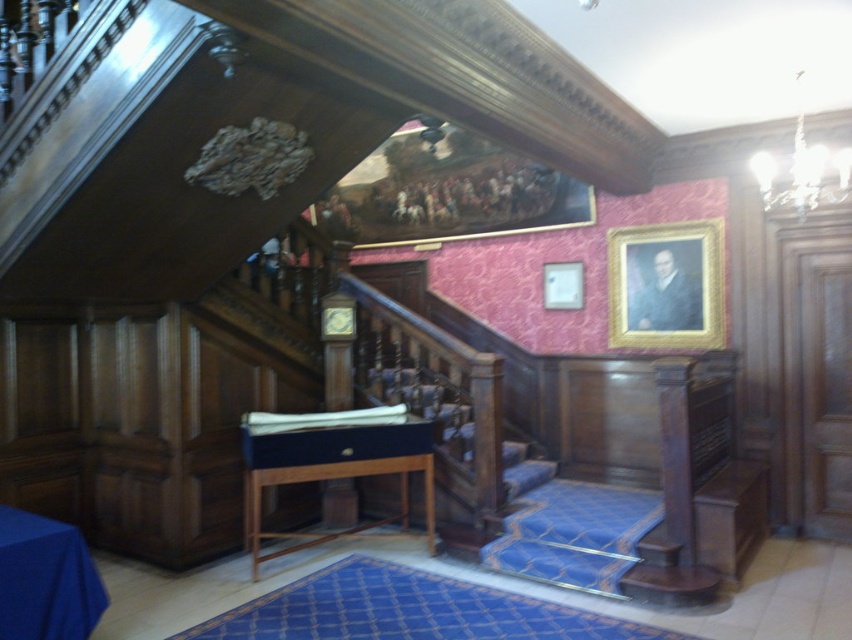
Question: Which object appears closest to the camera in this image?

Choices:
 (A) oil painting at upper center
 (B) gold-framed picture at upper center
 (C) gold/gilded wood portrait at upper right
 (D) blue fabric tablecloth at lower left

Answer: (D)

Question: Is oil painting at upper center smaller than white glass chandelier at upper right?

Choices:
 (A) yes
 (B) no

Answer: (B)

Question: Which point is closer to the camera taking this photo?

Choices:
 (A) (75, 596)
 (B) (377, 218)
 (C) (849, 182)
 (D) (543, 273)

Answer: (A)

Question: Is the position of oil painting at upper center less distant than that of gold/gilded wood portrait at upper right?

Choices:
 (A) no
 (B) yes

Answer: (A)

Question: Which object appears closest to the camera in this image?

Choices:
 (A) oil painting at upper center
 (B) blue fabric tablecloth at lower left
 (C) white glass chandelier at upper right

Answer: (B)

Question: Can you confirm if white glass chandelier at upper right is positioned to the right of gold-framed picture at upper center?

Choices:
 (A) yes
 (B) no

Answer: (A)